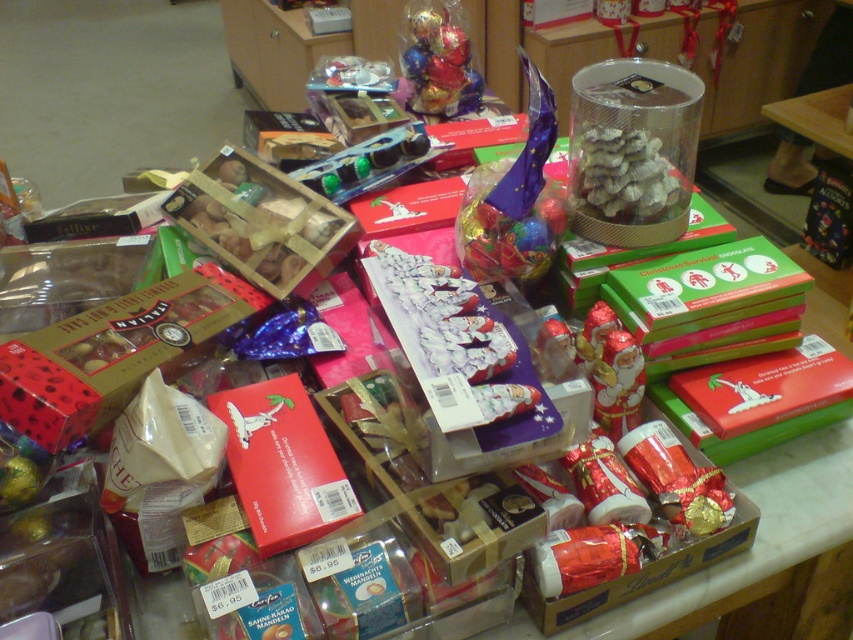
Question: Among these points, which one is farthest from the camera?

Choices:
 (A) (445, 19)
 (B) (625, 141)

Answer: (A)

Question: Among these points, which one is farthest from the camera?

Choices:
 (A) (461, 10)
 (B) (634, 208)

Answer: (A)

Question: In this image, where is shiny silver candy at center located relative to shiny foil wrapped chocolates at center?

Choices:
 (A) above
 (B) below

Answer: (B)

Question: Which point is closer to the camera?

Choices:
 (A) (575, 193)
 (B) (421, 86)

Answer: (A)

Question: Is shiny silver candy at center above shiny foil wrapped chocolates at center?

Choices:
 (A) yes
 (B) no

Answer: (B)

Question: Can you confirm if shiny silver candy at center is thinner than shiny foil wrapped chocolates at center?

Choices:
 (A) no
 (B) yes

Answer: (B)